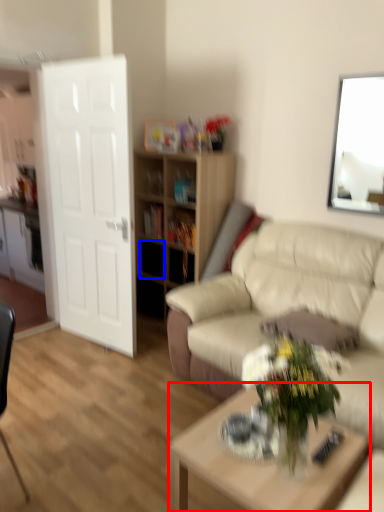
Question: Which of the following is the closest to the observer, coffee table (highlighted by a red box) or drawer (highlighted by a blue box)?

Choices:
 (A) coffee table
 (B) drawer

Answer: (A)